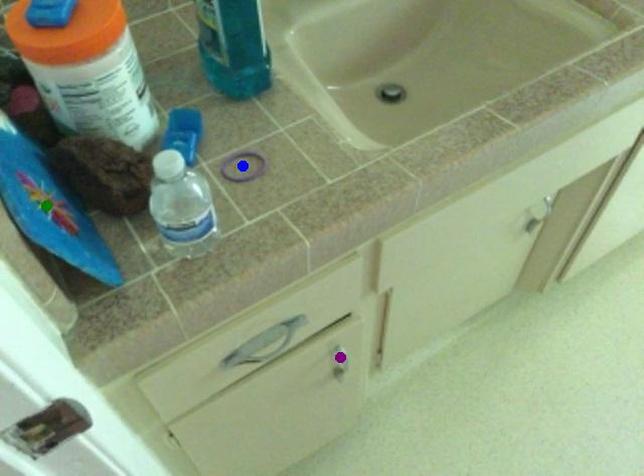
Order these from nearest to farthest:
1. green point
2. purple point
3. blue point

green point, blue point, purple point